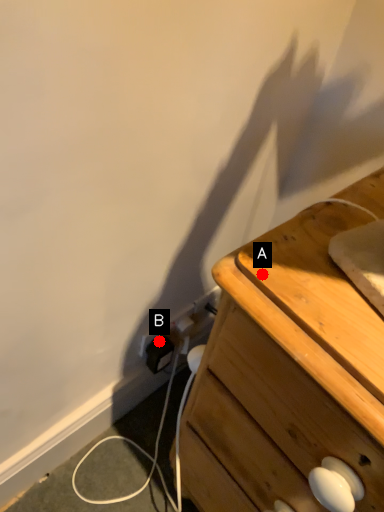
Question: Two points are circled on the image, labeled by A and B beside each circle. Which of the following is the farthest from the observer?

Choices:
 (A) A is further
 (B) B is further

Answer: (B)